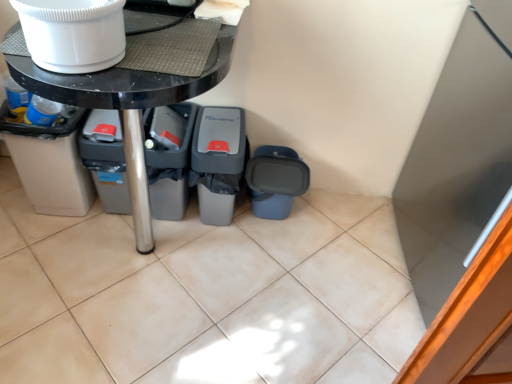
Find the location of `free space that is in between white glossy refrigerator at upper right and gray plastic recycling bin at center, which is the second recycling bin from right to left`. free space that is in between white glossy refrigerator at upper right and gray plastic recycling bin at center, which is the second recycling bin from right to left is located at coordinates (335, 248).